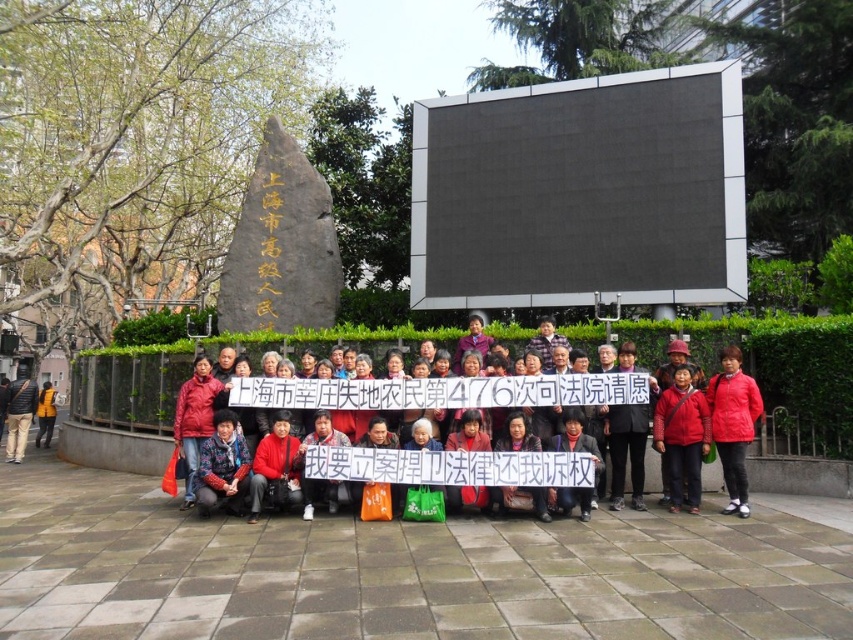
You are a photographer trying to capture a clear photo of both the red matte jacket at right and the matte black jacket at left. Since you want to focus on the jackets, you need to adjust your camera settings to ensure they are in sharp focus. Considering their sizes, which jacket should you focus on first to ensure the best depth of field?

The red matte jacket at right is thinner than the matte black jacket at left, so you should focus on the thinner red matte jacket at right first to ensure the best depth of field.

You are a photographer trying to capture a photo of the protest scene. You want to ensure both the red fabric coat at center and the red matte jacket at right are visible in the frame. Based on their positions, which object is closer to the left side of the photo?

The red fabric coat at center is positioned to the left of the red matte jacket at right, so it will appear closer to the left side of the photo.

You are a photographer at the protest scene. You want to take a photo that includes both the red fabric coat at center and the red matte jacket at right. Which object should you focus on first to ensure both are in frame?

The red fabric coat at center is larger in size than the red matte jacket at right, so you should focus on the red fabric coat at center first to ensure both are in frame.